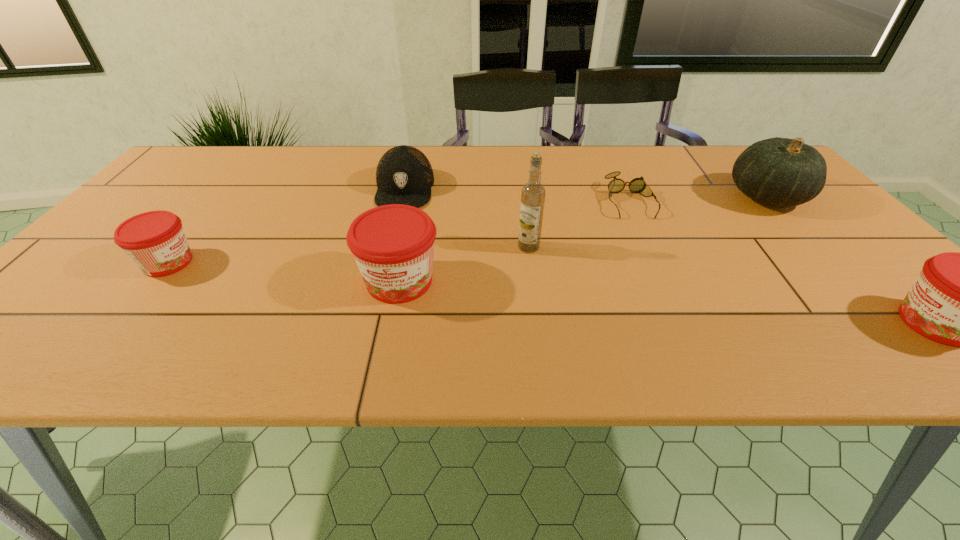
This screenshot has height=540, width=960. In order to click on object that is at the left edge in this screenshot , I will do `click(155, 241)`.

Find the location of `object that is at the right edge`. object that is at the right edge is located at coordinates (782, 172).

Where is `object situated at the far right corner`? This screenshot has height=540, width=960. object situated at the far right corner is located at coordinates (782, 172).

Locate an element on the screen. The image size is (960, 540). vacant space at the far edge of the desktop is located at coordinates (640, 159).

Where is `free space at the near edge of the desktop`? free space at the near edge of the desktop is located at coordinates (275, 301).

This screenshot has width=960, height=540. Find the location of `free space at the far left corner of the desktop`. free space at the far left corner of the desktop is located at coordinates (217, 157).

The height and width of the screenshot is (540, 960). Identify the location of free spot between the second tallest object and the second jam from left to right. (583, 239).

Where is `vacant area that lies between the gourd and the shortest jam`? The height and width of the screenshot is (540, 960). vacant area that lies between the gourd and the shortest jam is located at coordinates pyautogui.click(x=468, y=230).

At what (x,y) coordinates should I click in order to perform the action: click on free point between the vodka and the shortest jam. Please return your answer as a coordinate pair (x, y). This screenshot has height=540, width=960. Looking at the image, I should click on (348, 255).

What are the coordinates of `vacant area that lies between the sixth shortest object and the leftmost jam` in the screenshot? It's located at (468, 230).